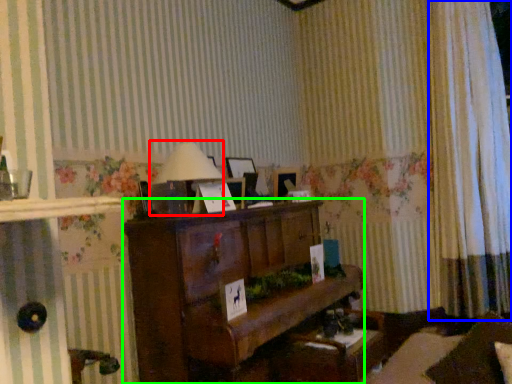
Question: Which object is positioned farthest from table lamp (highlighted by a red box)? Select from curtain (highlighted by a blue box) and furniture (highlighted by a green box).

Choices:
 (A) curtain
 (B) furniture

Answer: (A)